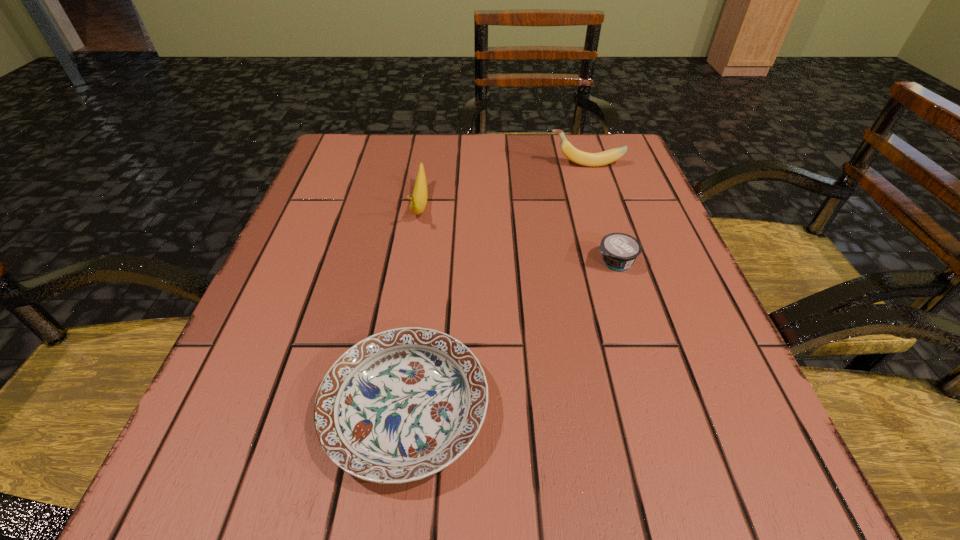
Find the location of `empty location between the farther banana and the yogurt`. empty location between the farther banana and the yogurt is located at coordinates (600, 213).

Where is `vacant point located between the plate and the nearer banana`? This screenshot has height=540, width=960. vacant point located between the plate and the nearer banana is located at coordinates (413, 308).

The width and height of the screenshot is (960, 540). Identify the location of free space between the nearest object and the left banana. (413, 308).

Locate an element on the screen. vacant space in between the third farthest object and the farther banana is located at coordinates (600, 213).

This screenshot has width=960, height=540. I want to click on vacant space in between the nearest object and the nearer banana, so click(x=413, y=308).

Image resolution: width=960 pixels, height=540 pixels. Identify the location of object that is the second closest to the second farthest object. (577, 156).

Select which object appears as the third closest to the nearest object. Please provide its 2D coordinates. Your answer should be formatted as a tuple, i.e. [(x, y)], where the tuple contains the x and y coordinates of a point satisfying the conditions above.

[(577, 156)]

This screenshot has height=540, width=960. I want to click on vacant space that satisfies the following two spatial constraints: 1. at the stem of the left banana; 2. on the right side of the yogurt, so click(411, 262).

Find the location of a particular element. Image resolution: width=960 pixels, height=540 pixels. vacant space that satisfies the following two spatial constraints: 1. at the stem of the farther banana; 2. on the front side of the nearest object is located at coordinates (663, 409).

Identify the location of vacant region that satisfies the following two spatial constraints: 1. at the stem of the yogurt; 2. on the right side of the second farthest object. point(411,262).